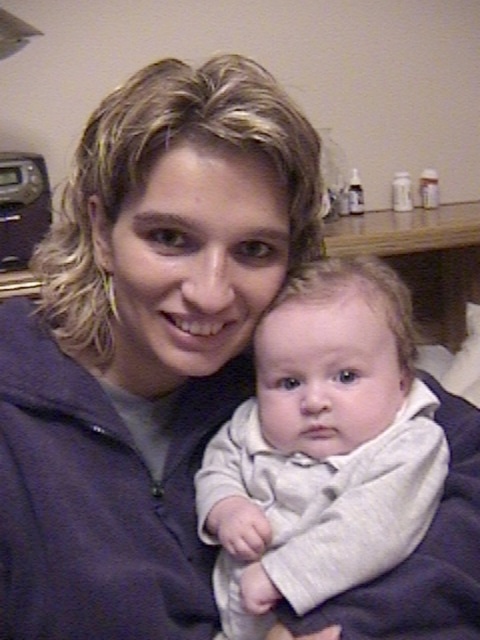
You are a photographer setting up a photo shoot. You have a dark blue fleece at center and a white soft baby at center in the scene. You want to ensure the baby is visible against the fleece. Based on the objects provided, which object is bigger and might need adjustment to avoid overwhelming the composition?

The dark blue fleece at center is larger than the white soft baby at center. To ensure the baby remains visible, you may need to adjust the size or position of the dark blue fleece at center so it doesn

Based on the photo, you are a photographer setting up for a photo shoot. You have a dark blue fleece at center and a white soft baby at center in your frame. To ensure both subjects are in focus, you need to know which one is taller. Which object is taller?

The dark blue fleece at center is taller than the white soft baby at center.

You are a photographer setting up for a family photo. You need to ensure that the dark blue fleece at center and the white soft baby at center are both visible in the frame. Based on their positions, which object should you focus on first to ensure both are in focus?

The dark blue fleece at center is above the white soft baby at center. To ensure both are in focus, you should focus on the dark blue fleece at center first since it is closer to the camera, and then adjust the focus to include the white soft baby at center.